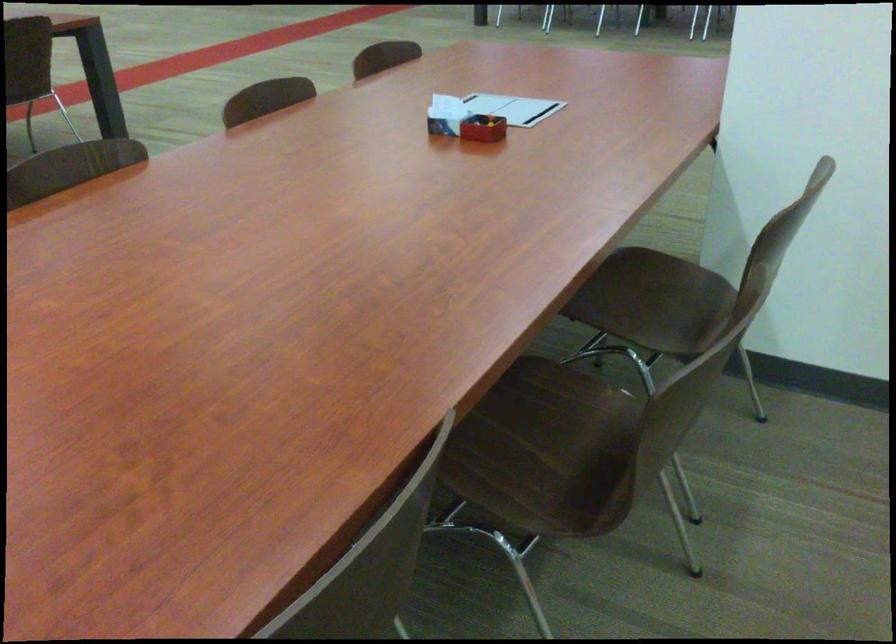
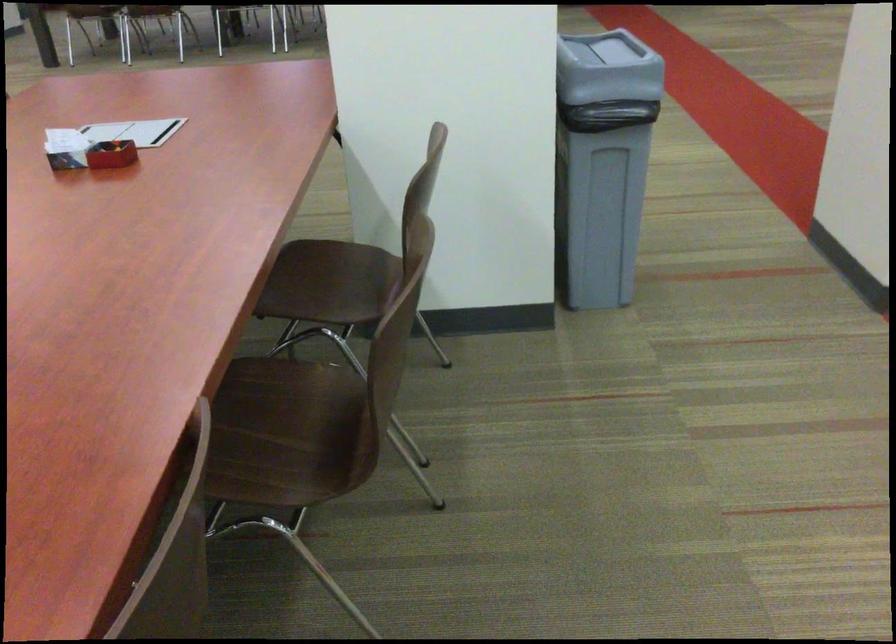
Question: How did the camera likely rotate?

Choices:
 (A) Left
 (B) Right
 (C) Up
 (D) Down

Answer: (B)